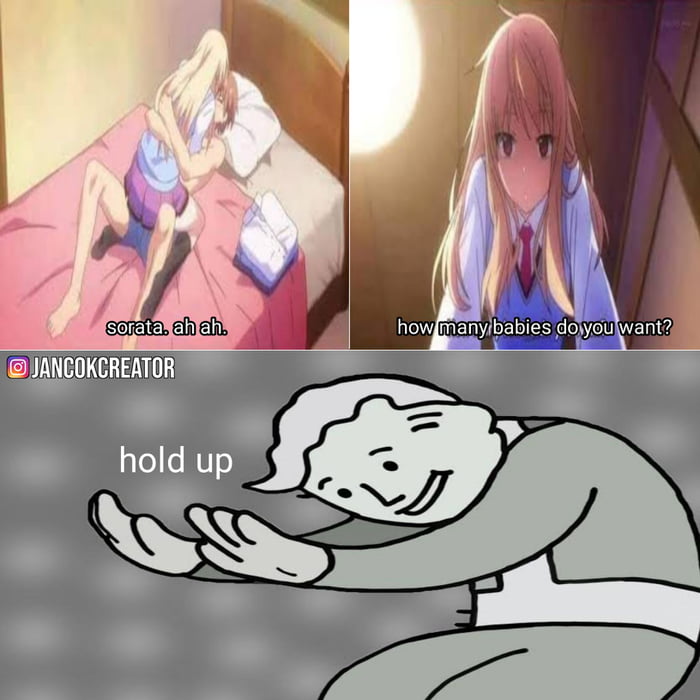
Where is `pillow`? The height and width of the screenshot is (700, 700). pillow is located at coordinates (264, 108).